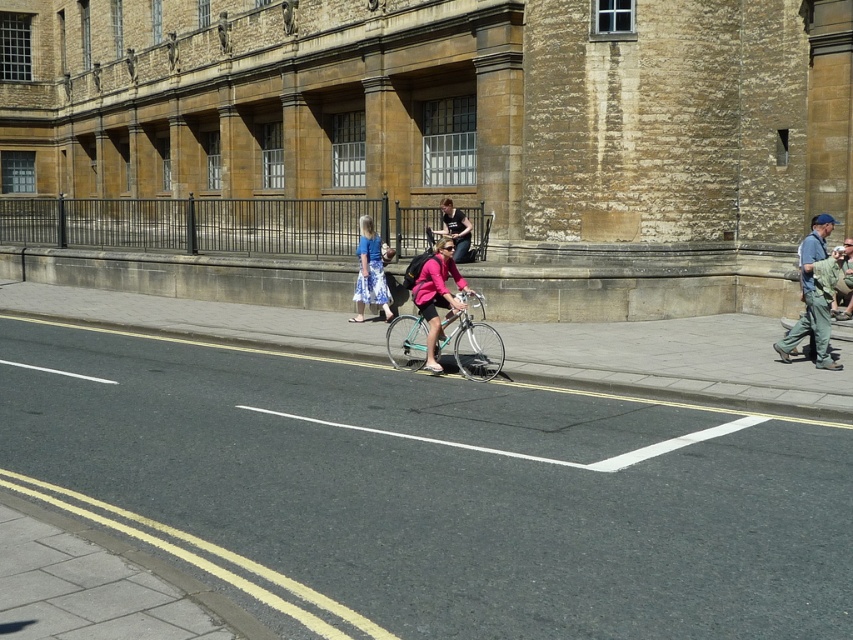
Question: Is teal metallic bicycle at center below matte blue dress at center?

Choices:
 (A) yes
 (B) no

Answer: (A)

Question: Which of the following is the closest to the observer?

Choices:
 (A) (291, 378)
 (B) (453, 259)

Answer: (A)

Question: Which object is the farthest from the matte blue dress at center?

Choices:
 (A) matte pink shirt at center
 (B) teal metallic bicycle at center
 (C) matte pink jacket at center

Answer: (C)

Question: Among these objects, which one is farthest from the camera?

Choices:
 (A) matte pink shirt at center
 (B) teal metallic bicycle at center
 (C) matte pink jacket at center
 (D) black asphalt bike lane at center

Answer: (A)

Question: Is teal metallic bicycle at center in front of matte pink jacket at center?

Choices:
 (A) no
 (B) yes

Answer: (B)

Question: In this image, where is teal metallic bicycle at center located relative to matte pink jacket at center?

Choices:
 (A) below
 (B) above

Answer: (A)